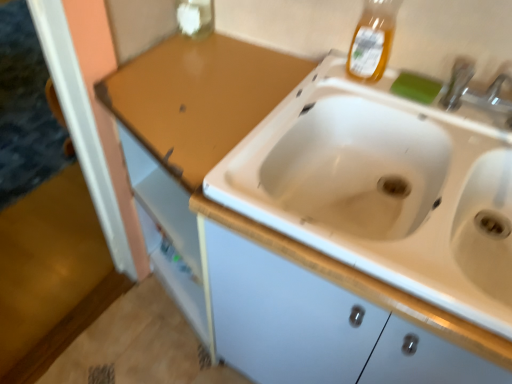
This screenshot has width=512, height=384. I want to click on free space to the left of translucent amber liquid at upper right, the first bottle from the front, so click(323, 81).